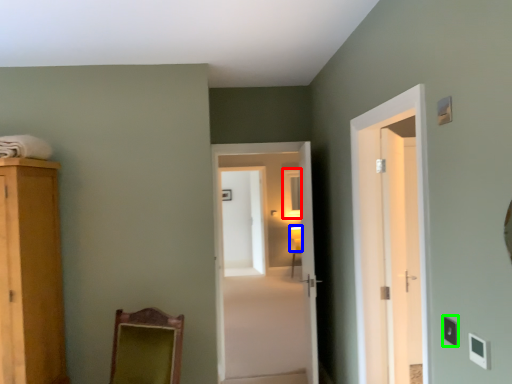
Question: Estimate the real-world distances between objects in this image. Which object is farther from mirror (highlighted by a red box), light fixture (highlighted by a blue box) or light switch (highlighted by a green box)?

Choices:
 (A) light fixture
 (B) light switch

Answer: (B)